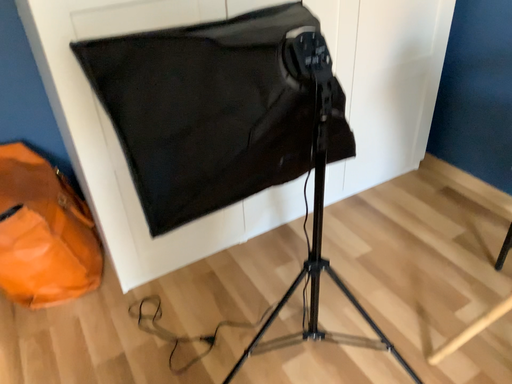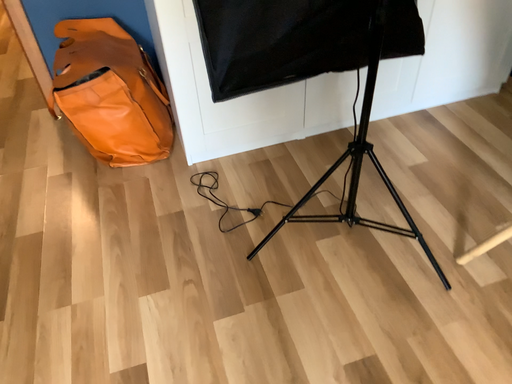
Question: Which way did the camera rotate in the video?

Choices:
 (A) rotated downward
 (B) rotated upward

Answer: (A)